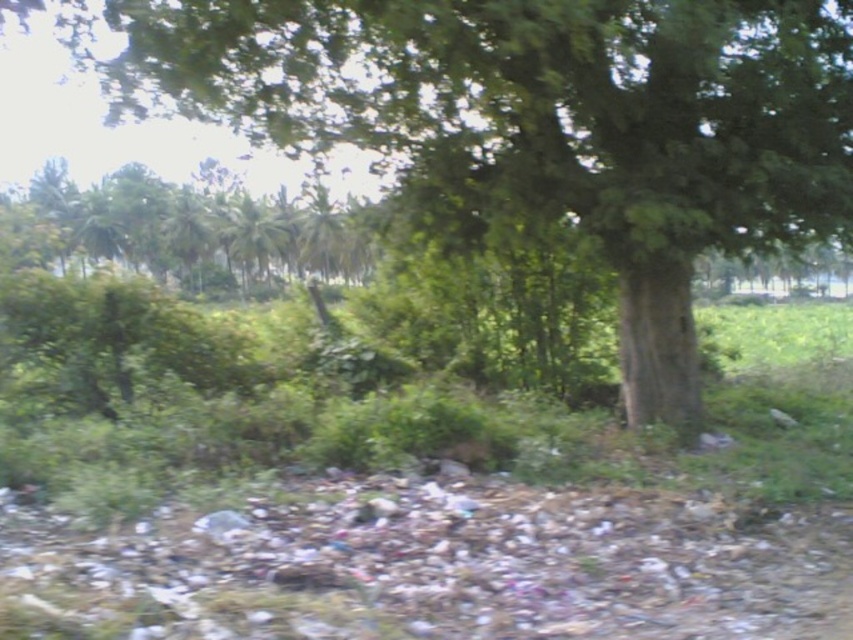
Question: Is green rough bark tree at center bigger than green leafy tree at upper left?

Choices:
 (A) yes
 (B) no

Answer: (B)

Question: Which of the following is the farthest from the observer?

Choices:
 (A) green leafy tree at upper left
 (B) green rough bark tree at center

Answer: (A)

Question: Is green rough bark tree at center wider than green leafy tree at upper left?

Choices:
 (A) yes
 (B) no

Answer: (B)

Question: Is green rough bark tree at center wider than green leafy tree at upper left?

Choices:
 (A) yes
 (B) no

Answer: (B)

Question: Which object is closer to the camera taking this photo?

Choices:
 (A) green rough bark tree at center
 (B) green leafy tree at upper left

Answer: (A)